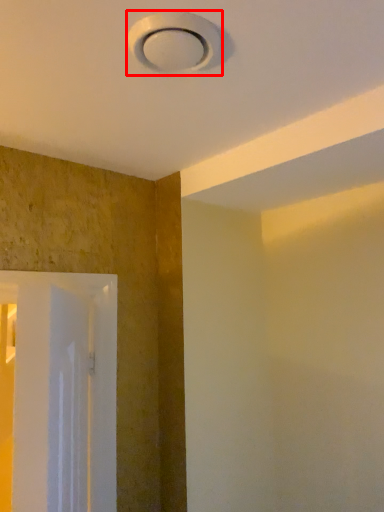
Question: In this image, where is lamp (annotated by the red box) located relative to screen door?

Choices:
 (A) left
 (B) right

Answer: (B)